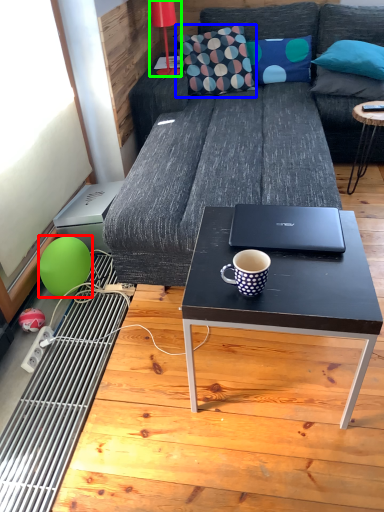
Question: Based on their relative distances, which object is farther from teal (highlighted by a red box)? Choose from throw pillow (highlighted by a blue box) and lamp (highlighted by a green box).

Choices:
 (A) throw pillow
 (B) lamp

Answer: (B)